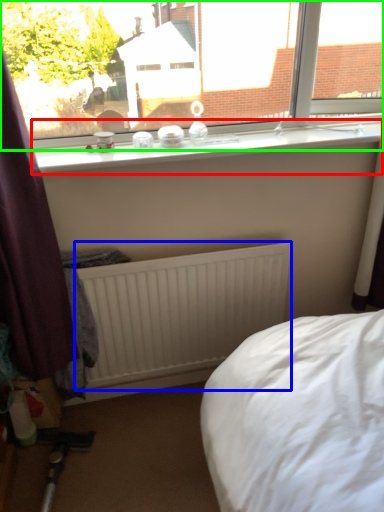
Question: Based on their relative distances, which object is nearer to window sill (highlighted by a red box)? Choose from radiator (highlighted by a blue box) and window (highlighted by a green box).

Choices:
 (A) radiator
 (B) window

Answer: (B)